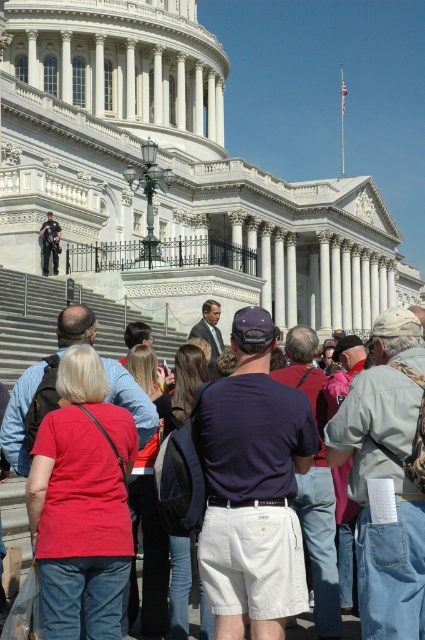
Who is positioned more to the right, matte red shirt at center or dark blue t-shirt at center?

dark blue t-shirt at center

Can you confirm if matte red shirt at center is positioned to the right of dark blue t-shirt at center?

No, matte red shirt at center is not to the right of dark blue t-shirt at center.

You are a GUI agent. You are given a task and a screenshot of the screen. Output one action in this format:
    pyautogui.click(x=<x>, y=<y>)
    Task: Click on the matte red shirt at center
    This screenshot has width=425, height=640.
    Given the screenshot: What is the action you would take?
    pyautogui.click(x=82, y=502)

Can you confirm if denim jacket at lower right is thinner than red fabric shirt at center?

Incorrect, denim jacket at lower right's width is not less than red fabric shirt at center's.

Is denim jacket at lower right smaller than red fabric shirt at center?

Incorrect, denim jacket at lower right is not smaller in size than red fabric shirt at center.

Does point (408, 397) lie behind point (127, 611)?

That is False.

Find the location of a particular element. This screenshot has width=425, height=640. denim jacket at lower right is located at coordinates (387, 476).

Does denim jacket at lower right appear over dark blue t-shirt at center?

No.

Who is more distant from viewer, [379,422] or [297,340]?

Point [297,340]

Describe the element at coordinates (387, 476) in the screenshot. This screenshot has height=640, width=425. I see `denim jacket at lower right` at that location.

Image resolution: width=425 pixels, height=640 pixels. Identify the location of denim jacket at lower right. (387, 476).